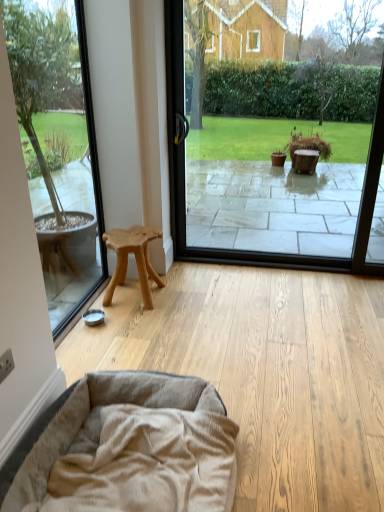
Question: Is natural wood stool at left with transparent glass window at left, which is the 2th window screen in right-to-left order?

Choices:
 (A) yes
 (B) no

Answer: (B)

Question: Is transparent glass window at left, positioned as the 1th window screen in left-to-right order, at the back of natural wood stool at left?

Choices:
 (A) yes
 (B) no

Answer: (B)

Question: Is natural wood stool at left far away from transparent glass window at left, which is the 2th window screen in right-to-left order?

Choices:
 (A) no
 (B) yes

Answer: (A)

Question: Is natural wood stool at left taller than transparent glass window at left, which is the 2th window screen in right-to-left order?

Choices:
 (A) yes
 (B) no

Answer: (B)

Question: Can you confirm if natural wood stool at left is wider than transparent glass window at left, positioned as the 1th window screen in left-to-right order?

Choices:
 (A) no
 (B) yes

Answer: (B)

Question: Can you confirm if natural wood stool at left is smaller than transparent glass window at left, positioned as the 1th window screen in left-to-right order?

Choices:
 (A) no
 (B) yes

Answer: (A)

Question: Is transparent glass window at center, which is the second window screen in left-to-right order, outside natural wood stool at left?

Choices:
 (A) yes
 (B) no

Answer: (A)

Question: Is transparent glass window at center, which is counted as the first window screen, starting from the right, smaller than natural wood stool at left?

Choices:
 (A) yes
 (B) no

Answer: (B)

Question: Is transparent glass window at center, which is the second window screen in left-to-right order, facing away from natural wood stool at left?

Choices:
 (A) no
 (B) yes

Answer: (A)

Question: From a real-world perspective, is transparent glass window at center, which is counted as the first window screen, starting from the right, located higher than natural wood stool at left?

Choices:
 (A) no
 (B) yes

Answer: (B)

Question: Does transparent glass window at center, which is counted as the first window screen, starting from the right, contain natural wood stool at left?

Choices:
 (A) no
 (B) yes

Answer: (A)

Question: Is transparent glass window at center, which is the second window screen in left-to-right order, closer to camera compared to natural wood stool at left?

Choices:
 (A) no
 (B) yes

Answer: (B)

Question: Is transparent glass window at center, which is the second window screen in left-to-right order, touching beige plush dog bed at lower left?

Choices:
 (A) no
 (B) yes

Answer: (A)